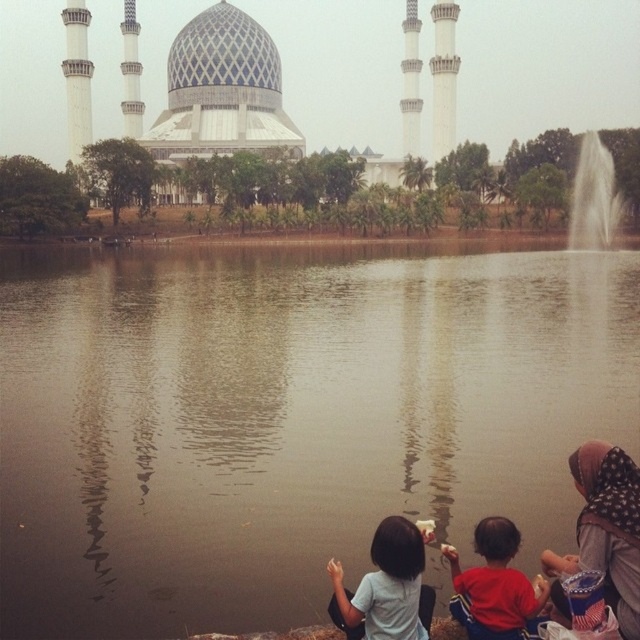
Question: Which object is positioned farthest from the matte gray children at lower center?

Choices:
 (A) brown reflective water at center
 (B) patterned fabric headscarf at lower right
 (C) red cotton shirt at lower right
 (D) light blue fabric shirt at lower center

Answer: (A)

Question: Which point appears farthest from the camera in this image?

Choices:
 (A) (593, 454)
 (B) (326, 609)
 (C) (512, 628)
 (D) (44, 353)

Answer: (D)

Question: Is light blue fabric shirt at lower center smaller than red cotton shirt at lower right?

Choices:
 (A) no
 (B) yes

Answer: (A)

Question: Which of these objects is positioned farthest from the brown reflective water at center?

Choices:
 (A) matte gray children at lower center
 (B) light blue fabric shirt at lower center
 (C) patterned fabric headscarf at lower right

Answer: (C)

Question: Observing the image, what is the correct spatial positioning of brown reflective water at center in reference to matte gray children at lower center?

Choices:
 (A) above
 (B) below

Answer: (A)

Question: Is brown reflective water at center to the left of patterned fabric headscarf at lower right from the viewer's perspective?

Choices:
 (A) yes
 (B) no

Answer: (A)